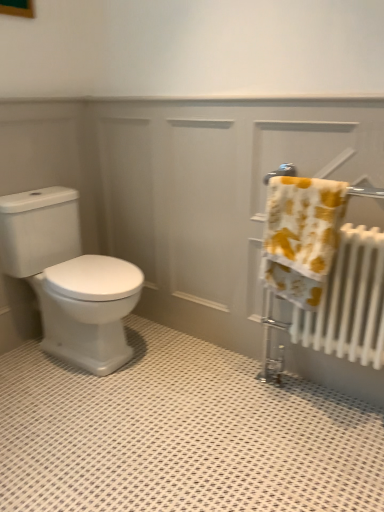
Question: Considering the positions of yellow printed towel at right and white glossy toilet at left in the image, is yellow printed towel at right bigger or smaller than white glossy toilet at left?

Choices:
 (A) small
 (B) big

Answer: (A)

Question: Is point (296, 185) closer or farther from the camera than point (62, 212)?

Choices:
 (A) farther
 (B) closer

Answer: (B)

Question: Which of these objects is positioned closest to the white glossy radiator at right?

Choices:
 (A) yellow printed towel at right
 (B) white glossy toilet at left

Answer: (A)

Question: Considering the real-world distances, which object is farthest from the white glossy radiator at right?

Choices:
 (A) yellow printed towel at right
 (B) white glossy toilet at left

Answer: (B)